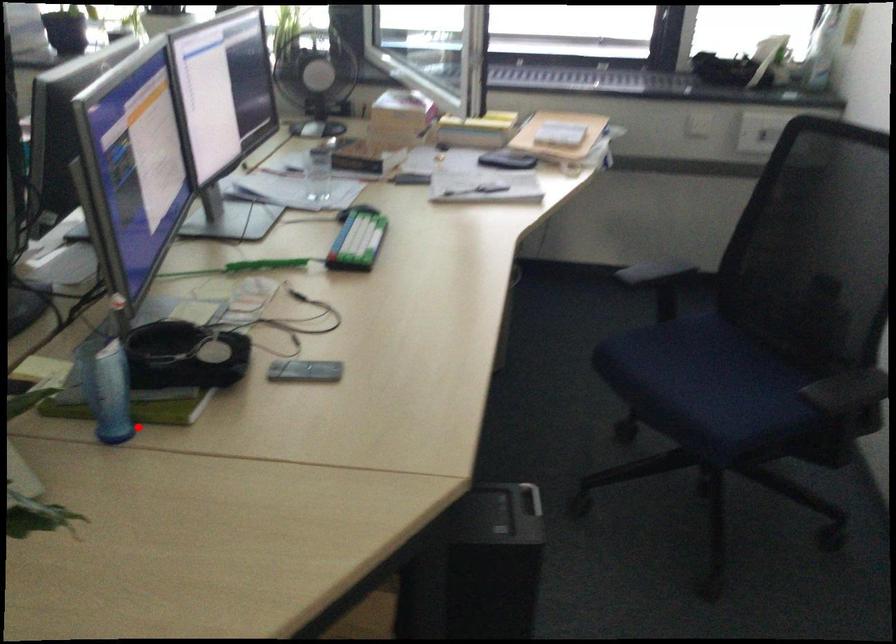
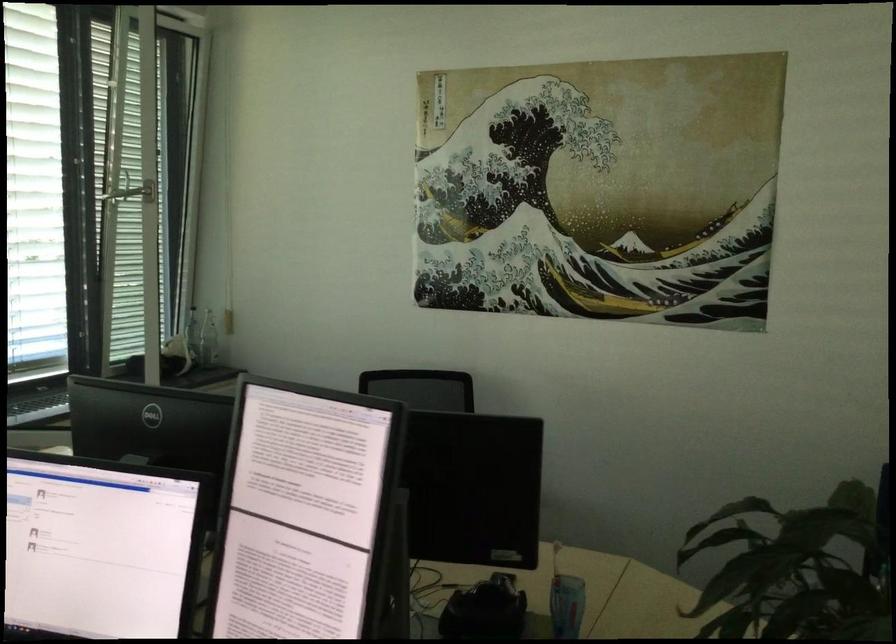
Locate, in the second image, the point that corresponds to the highlighted location in the first image.

(566, 605)